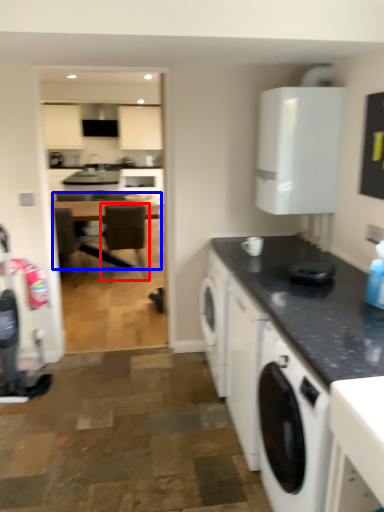
Question: Which point is closer to the camera, chair (highlighted by a red box) or table (highlighted by a blue box)?

Choices:
 (A) chair
 (B) table

Answer: (A)